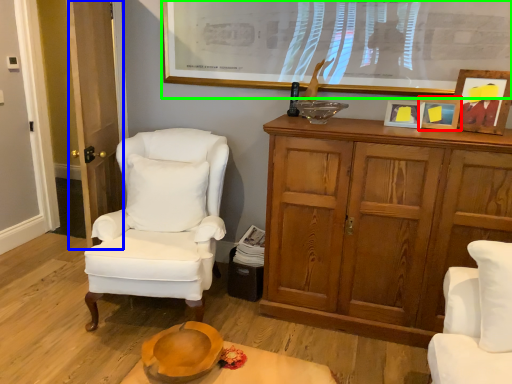
Question: Based on their relative distances, which object is nearer to picture frame (highlighted by a red box)? Choose from glass door (highlighted by a blue box) and picture frame (highlighted by a green box).

Choices:
 (A) glass door
 (B) picture frame

Answer: (B)